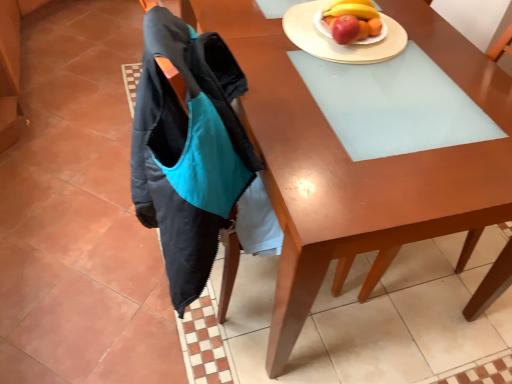
This screenshot has height=384, width=512. In order to click on vacant area that lies to the right of white glossy plate at upper right, arranged as the second plate when viewed from the left in this screenshot , I will do `click(417, 41)`.